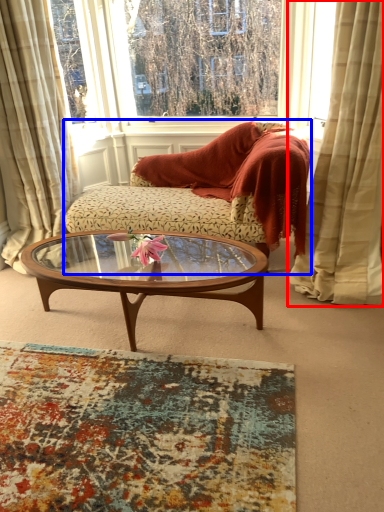
Question: Which object is further to the camera taking this photo, curtain (highlighted by a red box) or studio couch (highlighted by a blue box)?

Choices:
 (A) curtain
 (B) studio couch

Answer: (B)